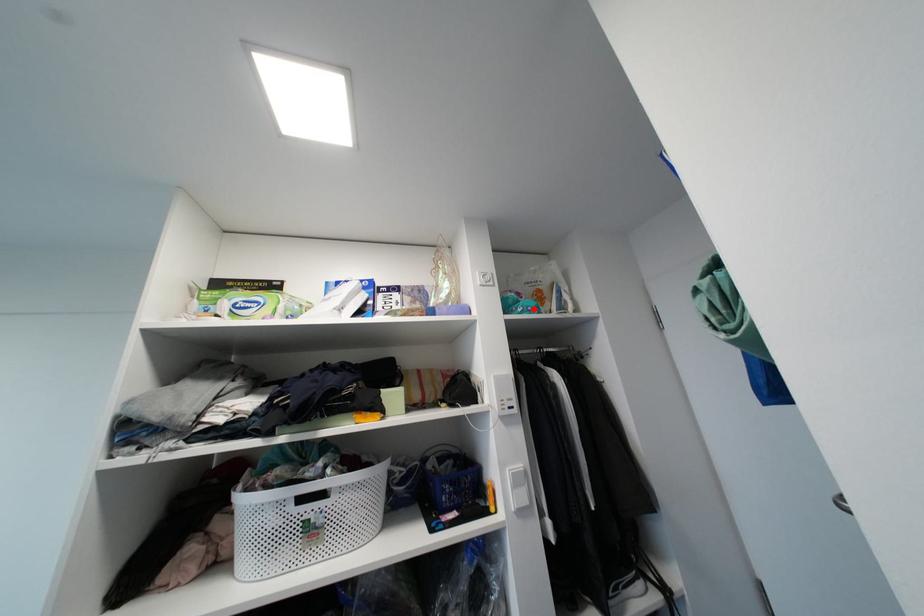
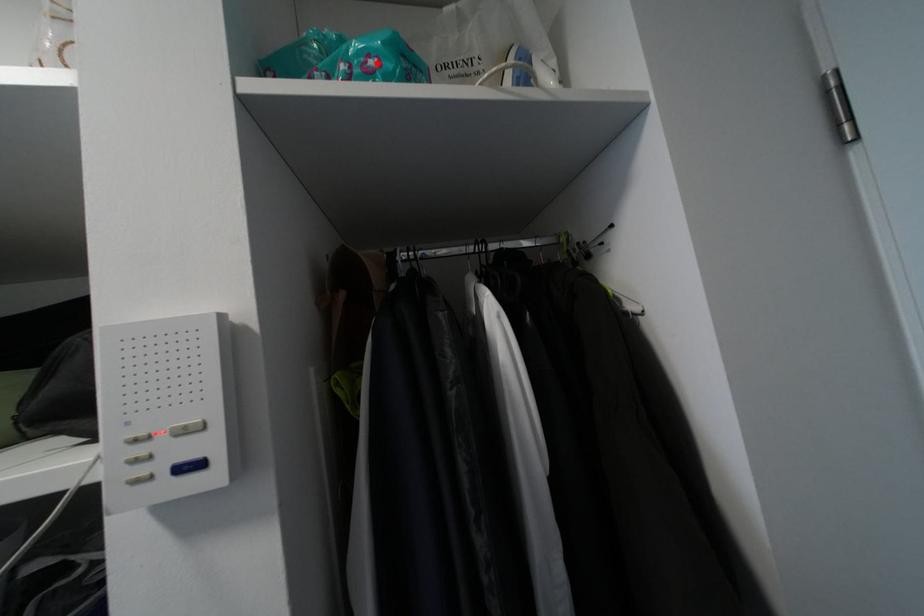
I am providing you with two images of the same scene from different viewpoints. A red point is marked on the first image and another point is marked on the second image. Do the highlighted points in image1 and image2 indicate the same real-world spot?

Yes